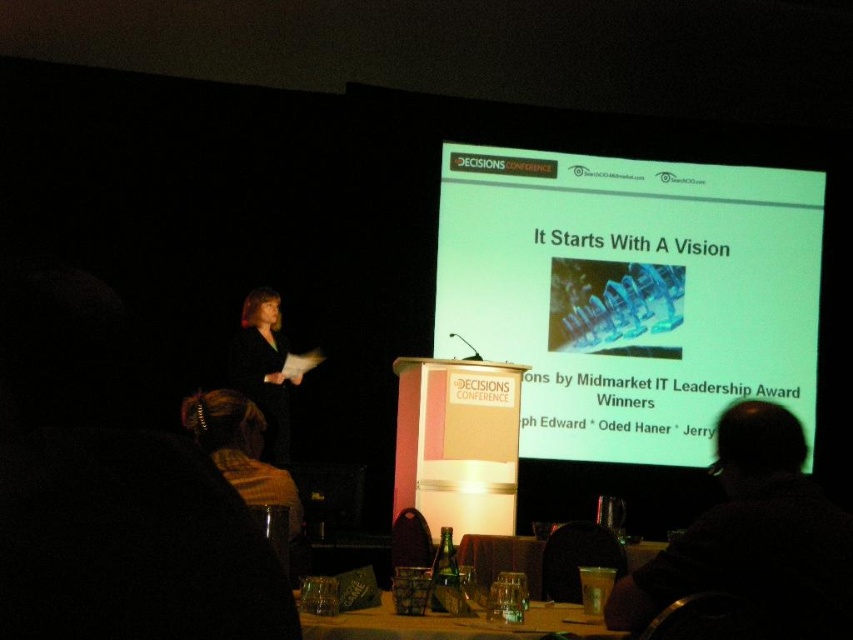
Based on the photo, between green matte projector screen at upper center and dark hair at upper right, which one has less height?

dark hair at upper right

Is point (706, 406) closer to camera compared to point (708, 589)?

No, (706, 406) is behind (708, 589).

Identify the location of green matte projector screen at upper center. (630, 292).

Is dark hair at upper right wider than brown knitted scarf at lower center?

Yes.

In the scene shown: Who is positioned more to the left, dark hair at upper right or brown knitted scarf at lower center?

From the viewer's perspective, brown knitted scarf at lower center appears more on the left side.

Where is `dark hair at upper right`? dark hair at upper right is located at coordinates (753, 536).

Image resolution: width=853 pixels, height=640 pixels. Identify the location of dark hair at upper right. (753, 536).

Does point (80, 604) lie in front of point (283, 442)?

Yes, point (80, 604) is closer to viewer.

Who is positioned more to the right, black fabric at left or matte black dress at left?

black fabric at left

Is point (204, 468) closer to camera compared to point (247, 317)?

That is True.

Where is `black fabric at left`? This screenshot has width=853, height=640. black fabric at left is located at coordinates (111, 490).